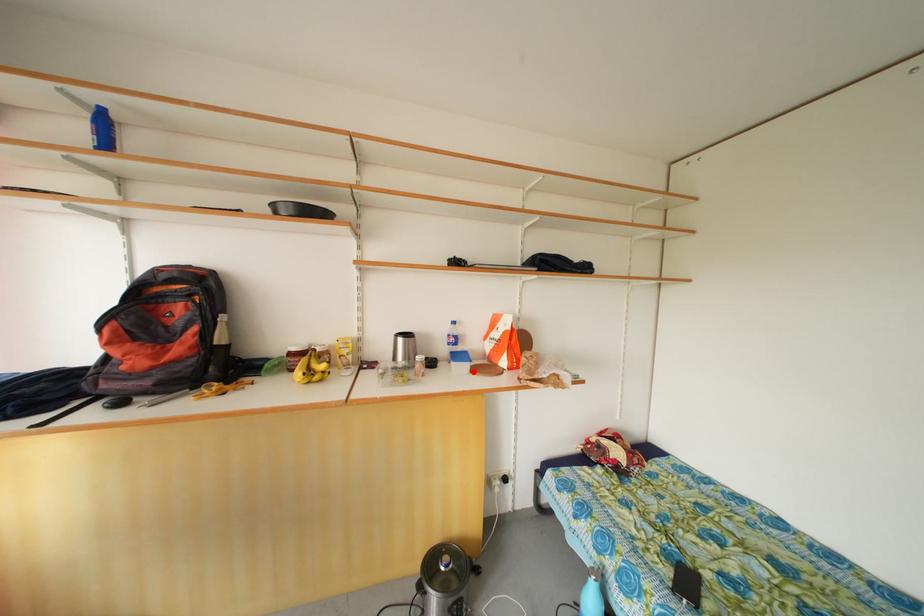
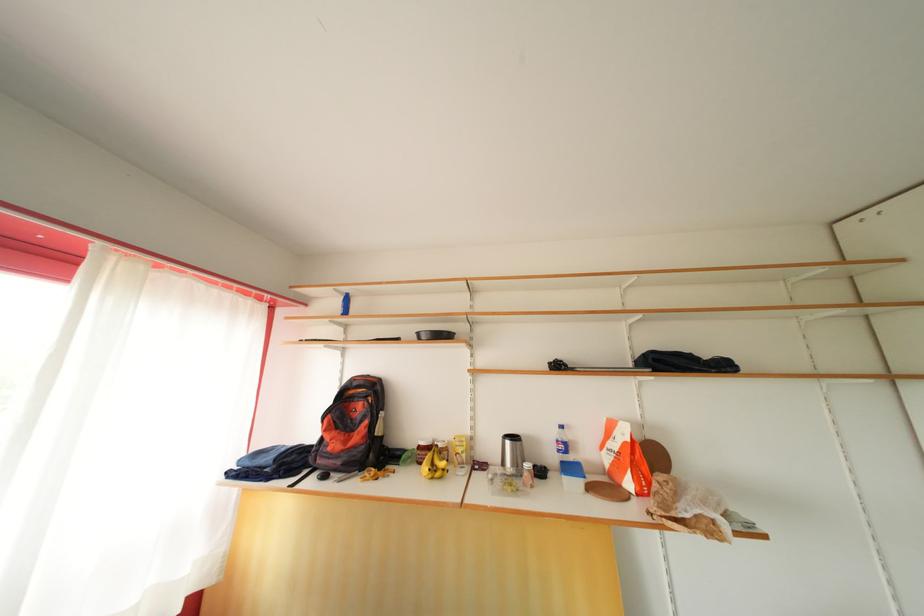
Where in the second image is the point corresponding to the highlighted location from the first image?

(587, 488)